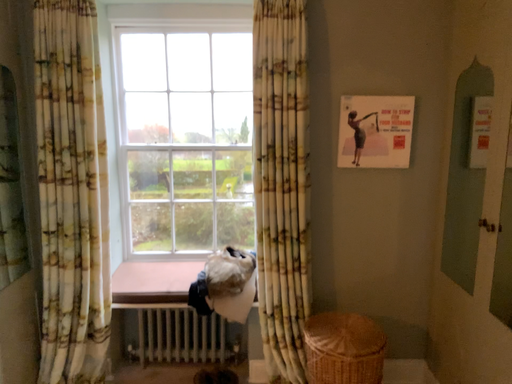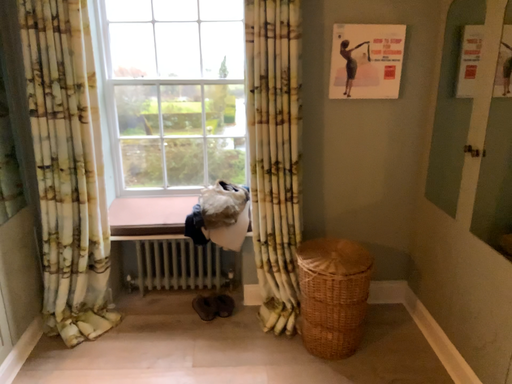
Question: How did the camera likely rotate when shooting the video?

Choices:
 (A) rotated downward
 (B) rotated upward

Answer: (A)